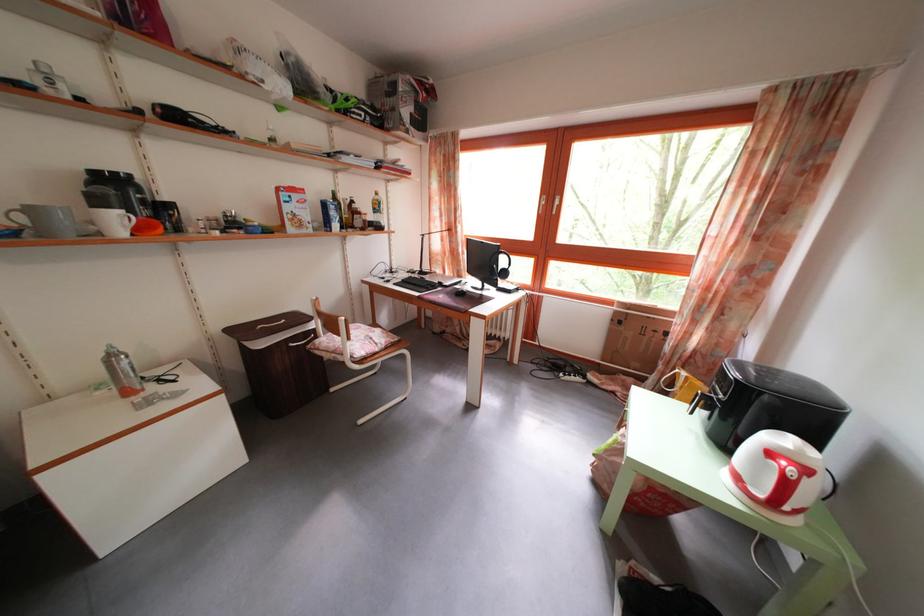
Where would you pull the hamper lid handle? Please return your answer as a coordinate pair (x, y).

(775, 476)